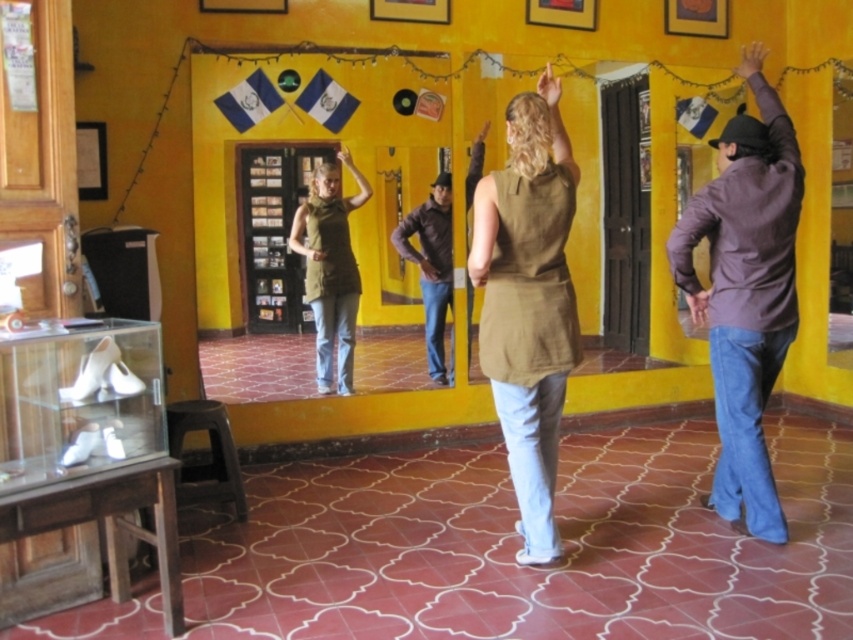
Question: Considering the real-world distances, which object is farthest from the dark brown leather jacket at center?

Choices:
 (A) green matte vest at center
 (B) dark purple jacket at upper right
 (C) matte olive-green vest at center

Answer: (C)

Question: Based on their relative distances, which object is farther from the dark purple jacket at upper right?

Choices:
 (A) matte olive-green vest at center
 (B) dark brown leather jacket at center
 (C) green matte vest at center

Answer: (C)

Question: Is dark purple jacket at upper right positioned behind dark brown leather jacket at center?

Choices:
 (A) yes
 (B) no

Answer: (B)

Question: Is the position of matte olive-green vest at center more distant than that of dark brown leather jacket at center?

Choices:
 (A) no
 (B) yes

Answer: (A)

Question: Which point is closer to the camera taking this photo?

Choices:
 (A) (415, 259)
 (B) (337, 244)

Answer: (B)

Question: Can you confirm if matte olive-green vest at center is bigger than green matte vest at center?

Choices:
 (A) no
 (B) yes

Answer: (A)